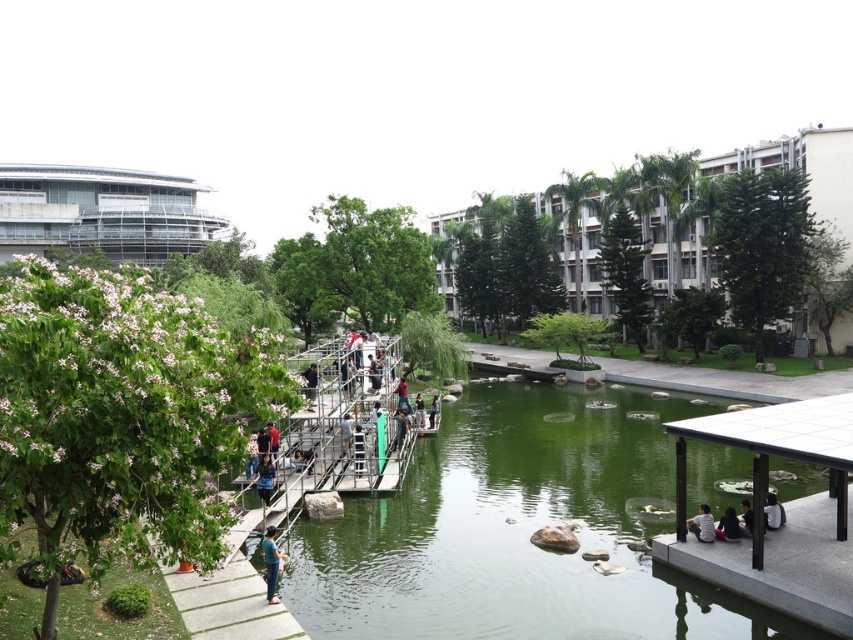
Between point (273, 589) and point (766, 506), which one is positioned behind?

Point (766, 506)

Between point (263, 548) and point (780, 516), which one is positioned behind?

Point (780, 516)

This screenshot has width=853, height=640. Find the location of `denim jeans at lower left`. denim jeans at lower left is located at coordinates (271, 563).

Find the location of a particular element. The height and width of the screenshot is (640, 853). white fabric person at lower right is located at coordinates (772, 513).

Between smooth concrete dock at lower right and light brown fabric jacket at lower right, which one has more height?

smooth concrete dock at lower right is taller.

Is smooth concrete dock at lower right below light brown fabric jacket at lower right?

No.

Is point (839, 563) positioned behind point (714, 532)?

No, it is in front of (714, 532).

The width and height of the screenshot is (853, 640). What are the coordinates of `smooth concrete dock at lower right` in the screenshot? It's located at (786, 508).